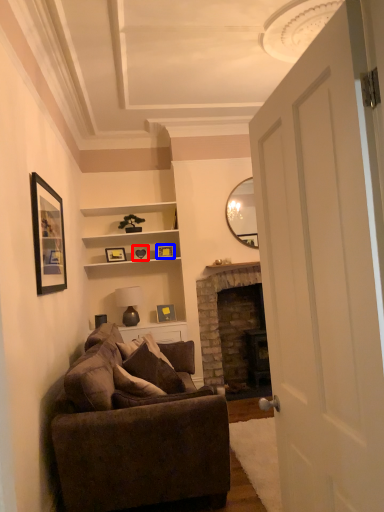
Question: Which of the following is the farthest to the observer, picture frame (highlighted by a red box) or picture frame (highlighted by a blue box)?

Choices:
 (A) picture frame
 (B) picture frame

Answer: (B)